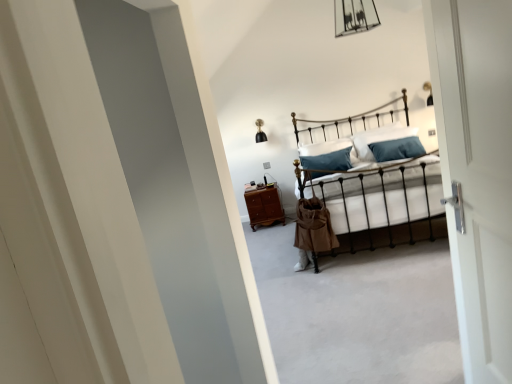
In order to click on metallic iron bed at center in this screenshot , I will do `click(368, 172)`.

Where is `white soft pillow at center, which is counted as the second pillow, starting from the right`? The height and width of the screenshot is (384, 512). white soft pillow at center, which is counted as the second pillow, starting from the right is located at coordinates (327, 155).

Find the location of `white soft pillow at center, the 1th pillow viewed from the right`. white soft pillow at center, the 1th pillow viewed from the right is located at coordinates (379, 139).

At what (x,y) coordinates should I click in order to perform the action: click on pillow that is the 2nd one when counting forward from the brown wooden nightstand at center. Please return your answer as a coordinate pair (x, y). Image resolution: width=512 pixels, height=384 pixels. Looking at the image, I should click on (327, 155).

From the image's perspective, is white soft pillow at center, which is counted as the second pillow, starting from the right, beneath brown wooden nightstand at center?

Incorrect, from the image's perspective, white soft pillow at center, which is counted as the second pillow, starting from the right, is higher than brown wooden nightstand at center.

Considering the sizes of objects white soft pillow at center, which is counted as the second pillow, starting from the right, and brown wooden nightstand at center in the image provided, who is bigger, white soft pillow at center, which is counted as the second pillow, starting from the right, or brown wooden nightstand at center?

With larger size is white soft pillow at center, which is counted as the second pillow, starting from the right.

From a real-world perspective, is white soft pillow at center, which is counted as the second pillow, starting from the right, over brown wooden nightstand at center?

Yes.

Is metallic iron bed at center located within brown wooden nightstand at center?

That's incorrect, metallic iron bed at center is not inside brown wooden nightstand at center.

Could you tell me if brown wooden nightstand at center is turned towards metallic iron bed at center?

No, brown wooden nightstand at center is not oriented towards metallic iron bed at center.

Is brown wooden nightstand at center at the right side of metallic iron bed at center?

No, brown wooden nightstand at center is not to the right of metallic iron bed at center.

Is brown wooden nightstand at center smaller than metallic iron bed at center?

Yes.

Which of these two, brown wooden nightstand at center or white soft pillow at center, which is the 1th pillow in left-to-right order, is bigger?

Bigger between the two is white soft pillow at center, which is the 1th pillow in left-to-right order.

From a real-world perspective, is brown wooden nightstand at center physically above white soft pillow at center, which is the 1th pillow in left-to-right order?

Incorrect, from a real-world perspective, brown wooden nightstand at center is lower than white soft pillow at center, which is the 1th pillow in left-to-right order.

Which is in front, point (259, 194) or point (343, 169)?

The point (343, 169) is more forward.

Which object is further away from the camera, white soft pillow at center, which is counted as the second pillow, starting from the right, or white soft pillow at center, acting as the 2th pillow starting from the left?

Positioned behind is white soft pillow at center, acting as the 2th pillow starting from the left.

Is white soft pillow at center, which is counted as the second pillow, starting from the right, positioned far away from white soft pillow at center, the 1th pillow viewed from the right?

white soft pillow at center, which is counted as the second pillow, starting from the right, is far away from white soft pillow at center, the 1th pillow viewed from the right.

Is white soft pillow at center, which is the 1th pillow in left-to-right order, taller or shorter than white soft pillow at center, the 1th pillow viewed from the right?

white soft pillow at center, which is the 1th pillow in left-to-right order, is shorter than white soft pillow at center, the 1th pillow viewed from the right.

Consider the image. Is white soft pillow at center, which is counted as the second pillow, starting from the right, to the right of white soft pillow at center, the 1th pillow viewed from the right, from the viewer's perspective?

Incorrect, white soft pillow at center, which is counted as the second pillow, starting from the right, is not on the right side of white soft pillow at center, the 1th pillow viewed from the right.

Can we say metallic iron bed at center lies outside brown wooden nightstand at center?

metallic iron bed at center is positioned outside brown wooden nightstand at center.

Are metallic iron bed at center and brown wooden nightstand at center beside each other?

No, metallic iron bed at center is not in contact with brown wooden nightstand at center.

Is point (303, 188) in front of point (260, 197)?

Yes, point (303, 188) is closer to viewer.

Looking at this image, between metallic iron bed at center and white soft pillow at center, which is the 1th pillow in left-to-right order, which one appears on the right side from the viewer's perspective?

Positioned to the right is metallic iron bed at center.

Which is behind, metallic iron bed at center or white soft pillow at center, which is counted as the second pillow, starting from the right?

white soft pillow at center, which is counted as the second pillow, starting from the right, is behind.

Can you confirm if metallic iron bed at center is bigger than white soft pillow at center, which is the 1th pillow in left-to-right order?

Yes.

Is white soft pillow at center, which is the 1th pillow in left-to-right order, surrounding metallic iron bed at center?

That's incorrect, metallic iron bed at center is not inside white soft pillow at center, which is the 1th pillow in left-to-right order.

From the image's perspective, who appears lower, white soft pillow at center, which is counted as the second pillow, starting from the right, or metallic iron bed at center?

From the image's view, metallic iron bed at center is below.

Between white soft pillow at center, which is counted as the second pillow, starting from the right, and metallic iron bed at center, which one has larger size?

metallic iron bed at center.

Which is behind, point (347, 144) or point (335, 222)?

The point (347, 144) is behind.

Identify the location of the 1st pillow above the brown wooden nightstand at center (from the image's perspective). (327, 155).

Identify the location of bed that is in front of the brown wooden nightstand at center. (368, 172).

Which object lies nearer to the anchor point metallic iron bed at center, brown wooden nightstand at center or white soft pillow at center, which is the 1th pillow in left-to-right order?

white soft pillow at center, which is the 1th pillow in left-to-right order.

Considering their positions, is brown wooden nightstand at center positioned closer to white soft pillow at center, the 1th pillow viewed from the right, than metallic iron bed at center?

metallic iron bed at center.

Based on their spatial positions, is metallic iron bed at center or white soft pillow at center, which is the 1th pillow in left-to-right order, further from brown wooden nightstand at center?

The object further to brown wooden nightstand at center is metallic iron bed at center.

From the image, which object appears to be nearer to metallic iron bed at center, white soft pillow at center, which is the 1th pillow in left-to-right order, or white soft pillow at center, acting as the 2th pillow starting from the left?

white soft pillow at center, which is the 1th pillow in left-to-right order, lies closer to metallic iron bed at center than the other object.

Considering their positions, is metallic iron bed at center positioned further to white soft pillow at center, which is counted as the second pillow, starting from the right, than white soft pillow at center, acting as the 2th pillow starting from the left?

white soft pillow at center, acting as the 2th pillow starting from the left, is further to white soft pillow at center, which is counted as the second pillow, starting from the right.

Looking at the image, which one is located further to brown wooden nightstand at center, white soft pillow at center, the 1th pillow viewed from the right, or white soft pillow at center, which is counted as the second pillow, starting from the right?

white soft pillow at center, the 1th pillow viewed from the right, lies further to brown wooden nightstand at center than the other object.

Looking at this image, from the image, which object appears to be nearer to white soft pillow at center, acting as the 2th pillow starting from the left, metallic iron bed at center or brown wooden nightstand at center?

Among the two, metallic iron bed at center is located nearer to white soft pillow at center, acting as the 2th pillow starting from the left.

Looking at the image, which one is located further to white soft pillow at center, acting as the 2th pillow starting from the left, white soft pillow at center, which is counted as the second pillow, starting from the right, or brown wooden nightstand at center?

brown wooden nightstand at center is positioned further to the anchor white soft pillow at center, acting as the 2th pillow starting from the left.

The height and width of the screenshot is (384, 512). Find the location of `pillow between brown wooden nightstand at center and white soft pillow at center, acting as the 2th pillow starting from the left, in the horizontal direction`. pillow between brown wooden nightstand at center and white soft pillow at center, acting as the 2th pillow starting from the left, in the horizontal direction is located at coordinates (327, 155).

What are the coordinates of `pillow positioned between metallic iron bed at center and white soft pillow at center, acting as the 2th pillow starting from the left, from near to far` in the screenshot? It's located at (327, 155).